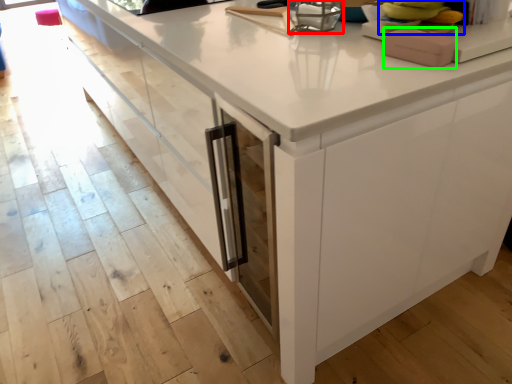
Question: Estimate the real-world distances between objects in this image. Which object is closer to appliance (highlighted by a red box), food (highlighted by a blue box) or appliance (highlighted by a green box)?

Choices:
 (A) food
 (B) appliance

Answer: (A)